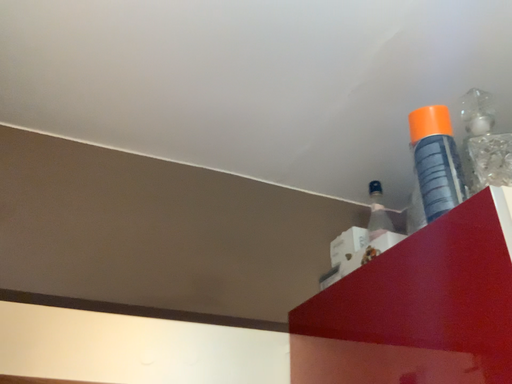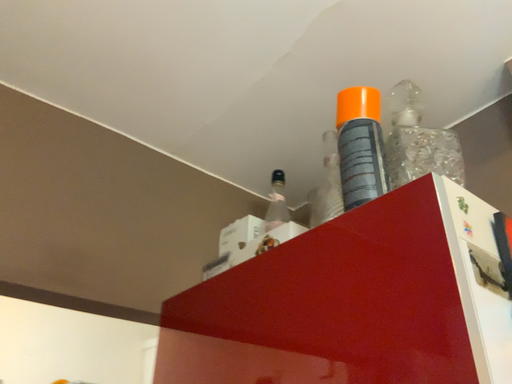
Question: How did the camera likely rotate when shooting the video?

Choices:
 (A) rotated right
 (B) rotated left

Answer: (A)